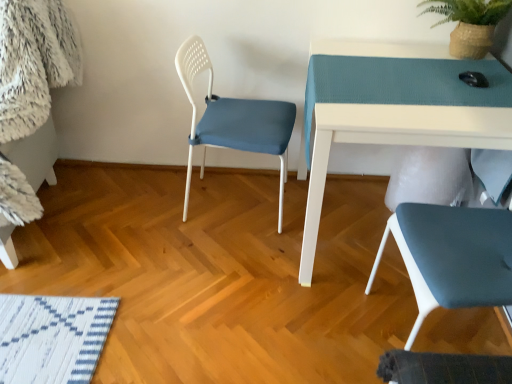
Find the location of a particular element. vacant area to the left of white plastic chair at center, which is the second chair from right to left is located at coordinates (141, 213).